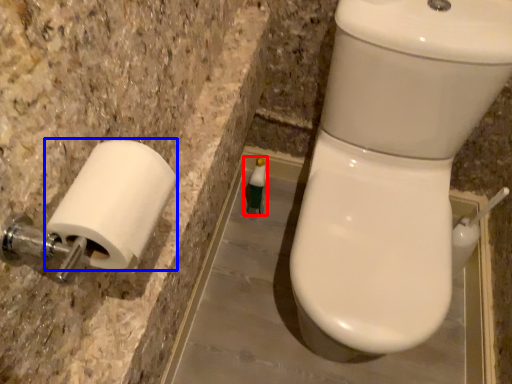
Question: Among these objects, which one is farthest to the camera, toiletry (highlighted by a red box) or toilet paper (highlighted by a blue box)?

Choices:
 (A) toiletry
 (B) toilet paper

Answer: (A)